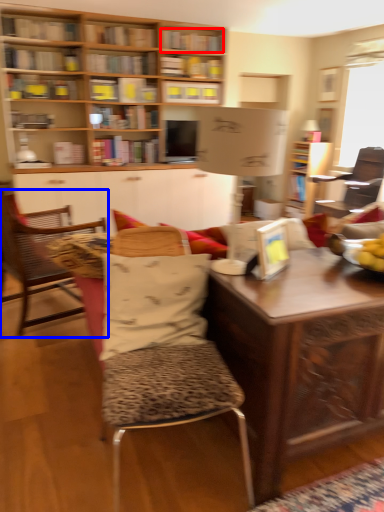
Question: Among these objects, which one is nearest to the camera, book (highlighted by a red box) or chair (highlighted by a blue box)?

Choices:
 (A) book
 (B) chair

Answer: (B)